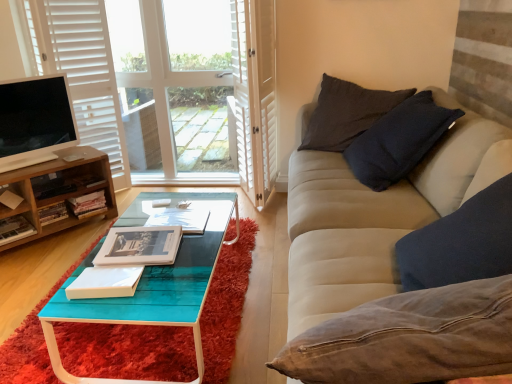
Image resolution: width=512 pixels, height=384 pixels. Identify the location of vacant space in white paper book at center, marked as the seventh book in a back-to-front arrangement (from a real-world perspective). (116, 341).